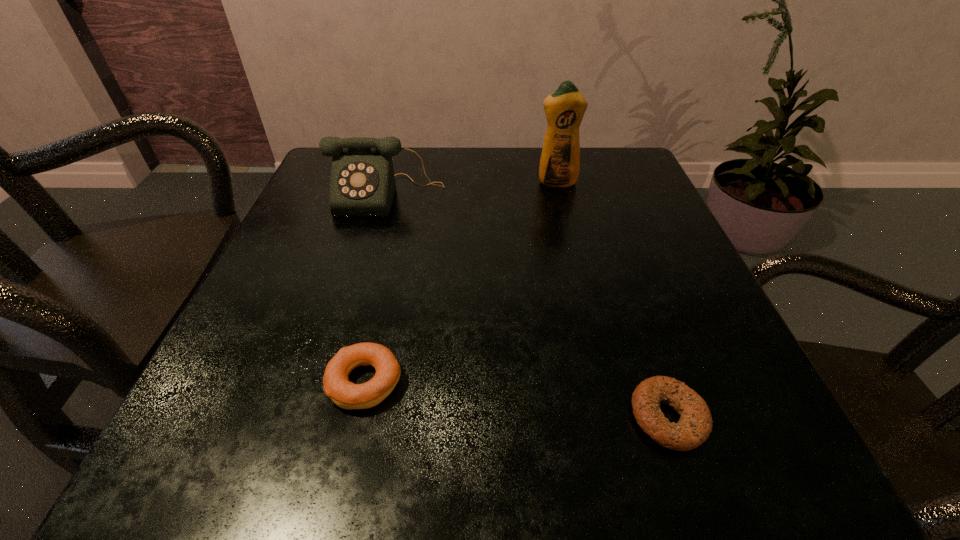
Identify the location of vacant region between the telephone and the right bagel. Image resolution: width=960 pixels, height=540 pixels. (527, 306).

You are a GUI agent. You are given a task and a screenshot of the screen. Output one action in this format:
    pyautogui.click(x=<x>, y=<y>)
    Task: Click on the free spot between the second tallest object and the left bagel
    
    Given the screenshot: What is the action you would take?
    pyautogui.click(x=375, y=288)

In order to click on free space between the third shortest object and the right bagel in this screenshot , I will do `click(527, 306)`.

Identify the location of free space between the left bagel and the detergent. This screenshot has width=960, height=540. pyautogui.click(x=461, y=282).

I want to click on vacant area between the second tallest object and the right bagel, so click(527, 306).

Where is `unoccupied area between the right bagel and the left bagel`? unoccupied area between the right bagel and the left bagel is located at coordinates (516, 400).

What are the coordinates of `unoccupied position between the telephone and the left bagel` in the screenshot? It's located at (375, 288).

Image resolution: width=960 pixels, height=540 pixels. Identify the location of free space between the telephone and the tallest object. (471, 189).

Identify the location of empty space that is in between the left bagel and the right bagel. The image size is (960, 540). (516, 400).

At what (x,y) coordinates should I click in order to perform the action: click on free point between the third shortest object and the right bagel. Please return your answer as a coordinate pair (x, y). Looking at the image, I should click on (527, 306).